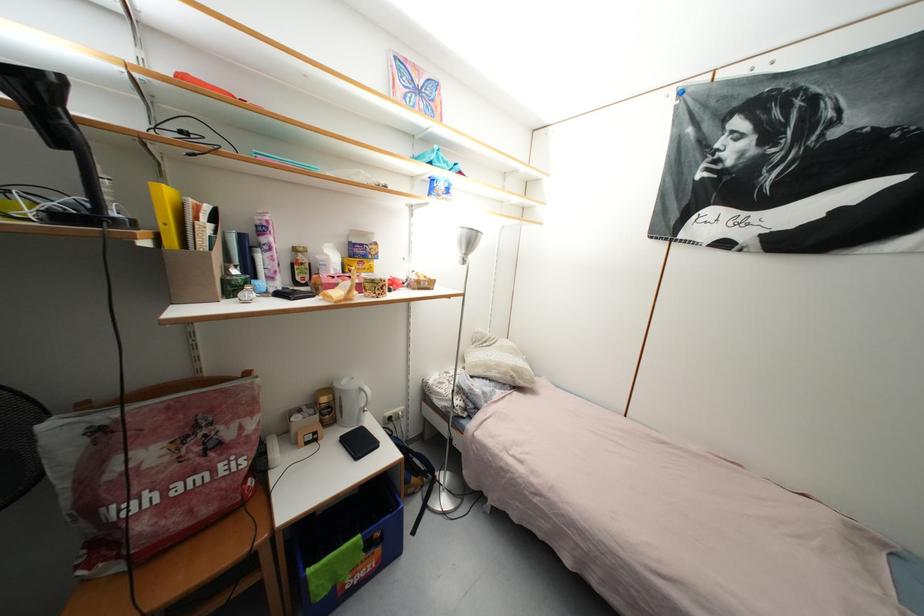
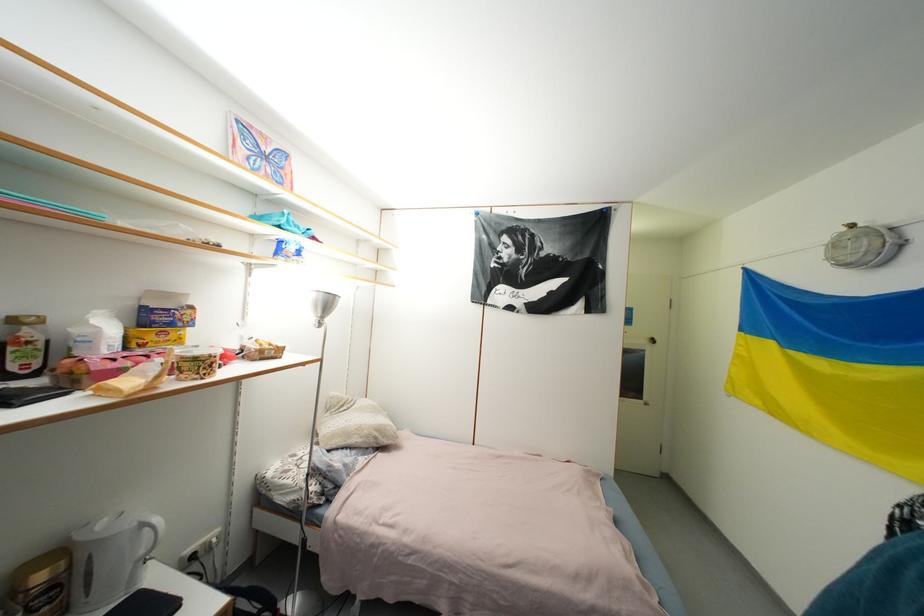
Where in the second image is the point corresponding to the point at 367,392 from the first image?

(149, 528)